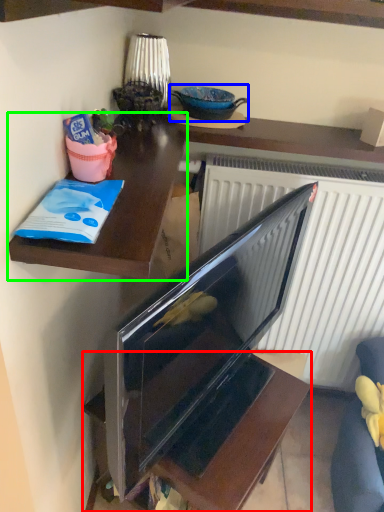
Question: Considering the real-world distances, which object is closest to furniture (highlighted by a red box)? appliance (highlighted by a blue box) or desk (highlighted by a green box).

Choices:
 (A) appliance
 (B) desk

Answer: (B)